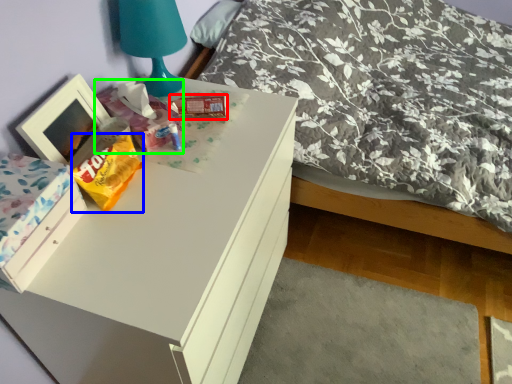
Question: Which object is the closest to the package (highlighted by a red box)? Choose among these: stuff (highlighted by a blue box) or package (highlighted by a green box).

Choices:
 (A) stuff
 (B) package

Answer: (B)